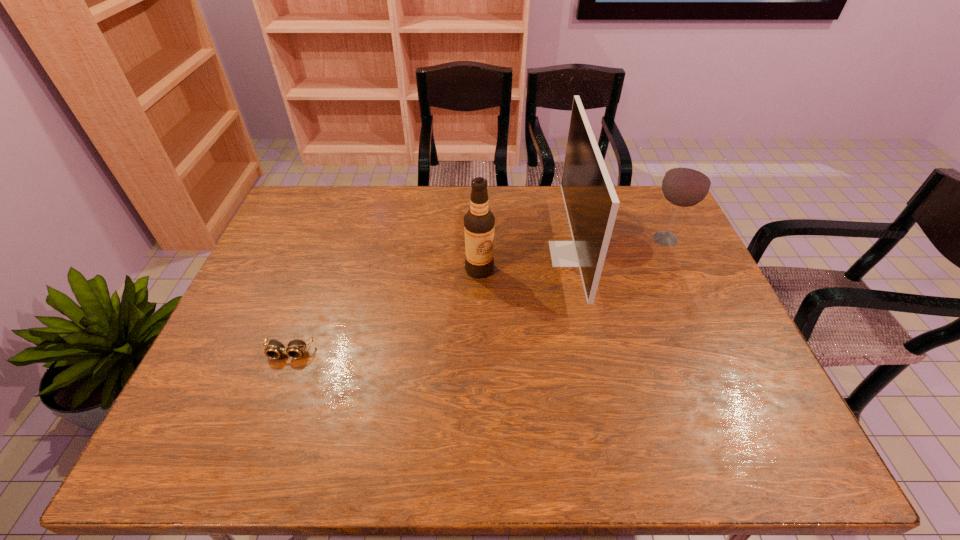
Where is `blank region between the nearest object and the rightmost object`? This screenshot has height=540, width=960. blank region between the nearest object and the rightmost object is located at coordinates (477, 296).

At what (x,y) coordinates should I click in order to perform the action: click on empty space between the nearest object and the second object from right to left. Please return your answer as a coordinate pair (x, y). This screenshot has height=540, width=960. Looking at the image, I should click on (430, 303).

Find the location of a particular element. The height and width of the screenshot is (540, 960). vacant space that is in between the shortest object and the farther alcohol is located at coordinates (477, 296).

Locate an element on the screen. This screenshot has height=540, width=960. free area in between the rightmost object and the monitor is located at coordinates (618, 246).

Choose which object is the second nearest neighbor to the left alcohol. Please provide its 2D coordinates. Your answer should be formatted as a tuple, i.e. [(x, y)], where the tuple contains the x and y coordinates of a point satisfying the conditions above.

[(296, 348)]

Where is `the third closest object to the nearer alcohol`? This screenshot has height=540, width=960. the third closest object to the nearer alcohol is located at coordinates (x=687, y=182).

Where is `vacant area that satisfies the following two spatial constraints: 1. on the front-facing side of the tallest object; 2. on the label of the nearer alcohol`? Image resolution: width=960 pixels, height=540 pixels. vacant area that satisfies the following two spatial constraints: 1. on the front-facing side of the tallest object; 2. on the label of the nearer alcohol is located at coordinates (574, 269).

This screenshot has width=960, height=540. I want to click on free location that satisfies the following two spatial constraints: 1. on the front-facing side of the monitor; 2. through the lenses of the goggles, so click(592, 353).

This screenshot has width=960, height=540. What are the coordinates of `free location that satisfies the following two spatial constraints: 1. on the front side of the rightmost object; 2. on the front-facing side of the third object from left to right` in the screenshot? It's located at (672, 254).